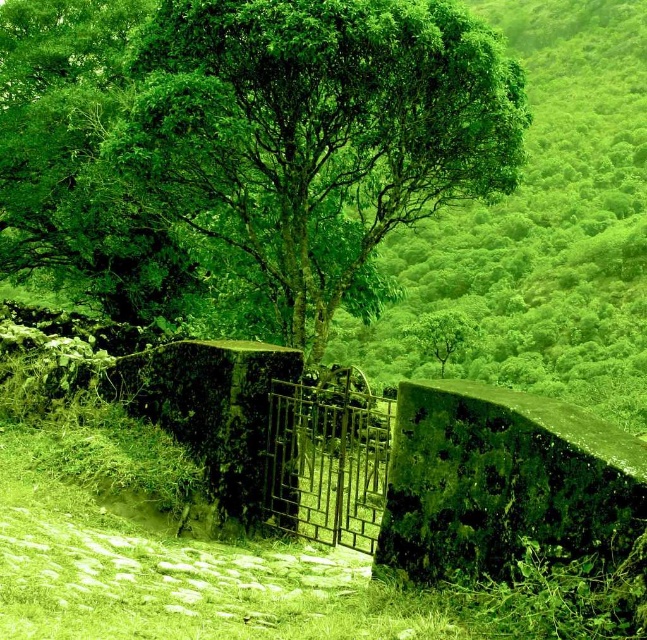
Is green leafy tree at center further to the viewer compared to rusty metal gate at center?

No, green leafy tree at center is closer to the viewer.

In the scene shown: Can you confirm if green leafy tree at center is positioned to the right of rusty metal gate at center?

Incorrect, green leafy tree at center is not on the right side of rusty metal gate at center.

This screenshot has height=640, width=647. In order to click on green leafy tree at center in this screenshot , I will do `click(316, 129)`.

Locate an element on the screen. Image resolution: width=647 pixels, height=640 pixels. green leafy tree at center is located at coordinates (316, 129).